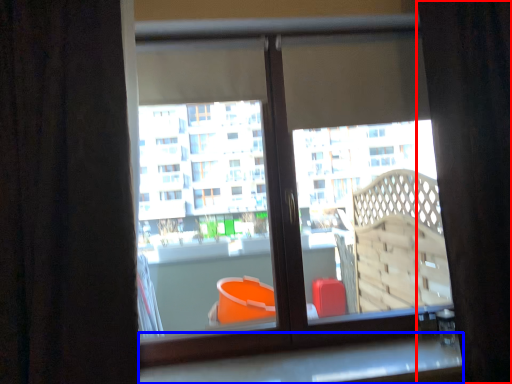
Question: Which object is further to the camera taking this photo, curtain (highlighted by a red box) or window sill (highlighted by a blue box)?

Choices:
 (A) curtain
 (B) window sill

Answer: (B)